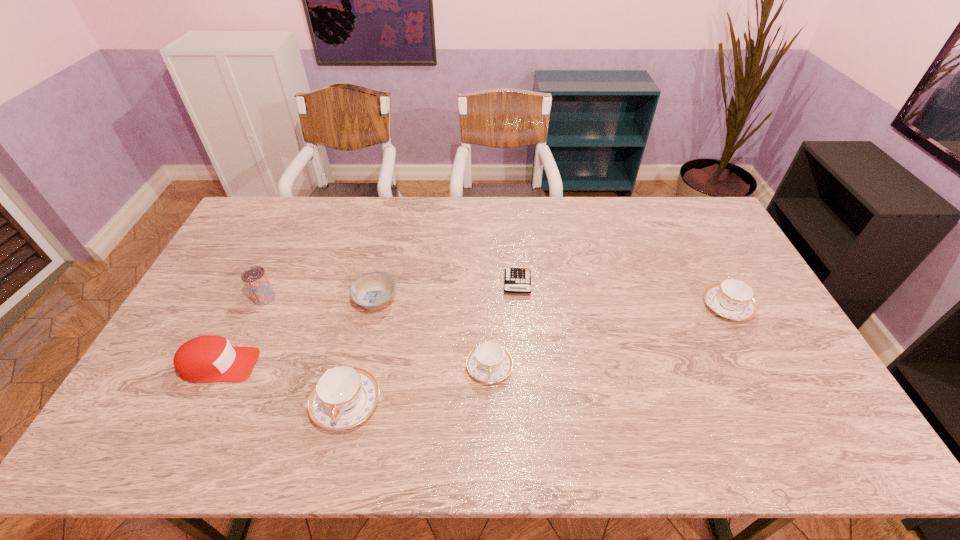
Locate an element on the screen. The image size is (960, 540). the leftmost teacup is located at coordinates (343, 397).

Identify the location of the second teacup from right to left. (489, 362).

At what (x,y) coordinates should I click in order to perform the action: click on the farthest teacup. Please return your answer as a coordinate pair (x, y). This screenshot has height=540, width=960. Looking at the image, I should click on (732, 298).

You are a GUI agent. You are given a task and a screenshot of the screen. Output one action in this format:
    pyautogui.click(x=<x>, y=<y>)
    Task: Click on the rightmost teacup
    The height and width of the screenshot is (540, 960).
    Given the screenshot: What is the action you would take?
    pyautogui.click(x=732, y=298)

I want to click on beer can, so click(x=255, y=279).

The height and width of the screenshot is (540, 960). Find the location of `bowl`. bowl is located at coordinates (372, 291).

Find the location of a particular element. Image resolution: width=960 pixels, height=540 pixels. baseball cap is located at coordinates (209, 358).

This screenshot has height=540, width=960. Identify the location of the shortest object. (516, 280).

The image size is (960, 540). I want to click on vacant space located on the side with the handle of the farthest teacup, so click(708, 272).

At what (x,y) coordinates should I click in order to perform the action: click on vacant space positioned 0.360m on the side with the handle of the farthest teacup. Please return your answer as a coordinate pair (x, y). The image size is (960, 540). Looking at the image, I should click on (681, 219).